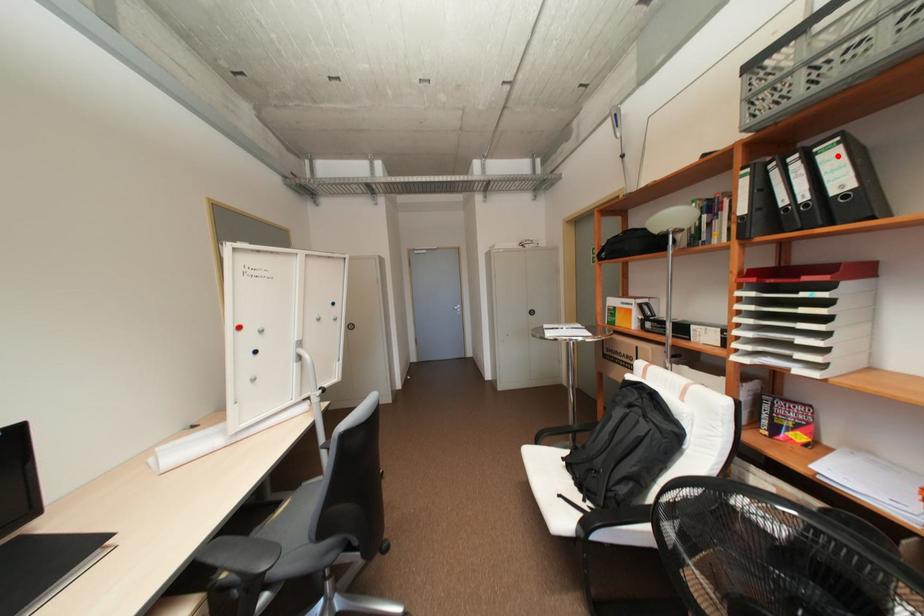
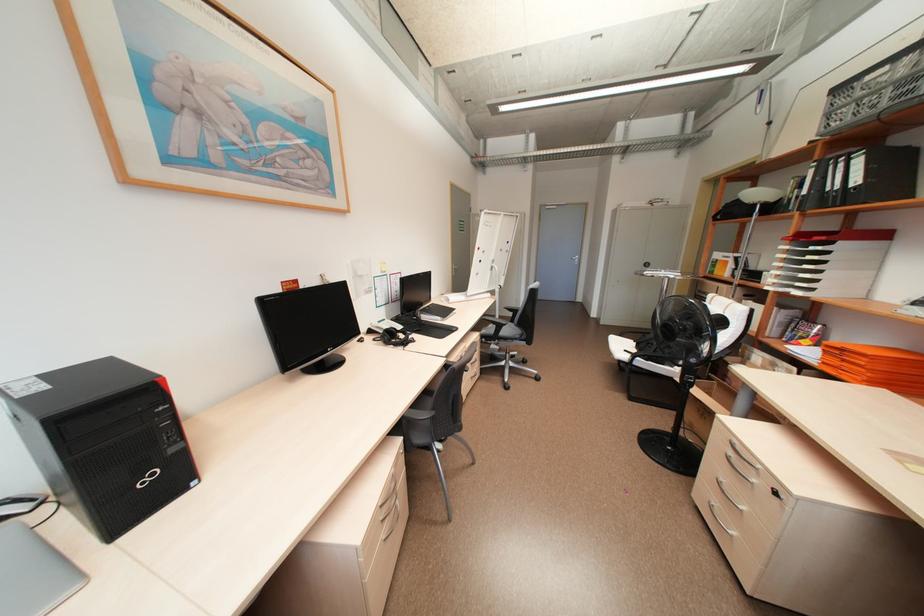
Question: I am providing you with two images of the same scene from different viewpoints. A red point is marked on the first image. At the location where the point appears in image 1, is it still visible in image 2?

Choices:
 (A) Yes
 (B) No

Answer: (A)